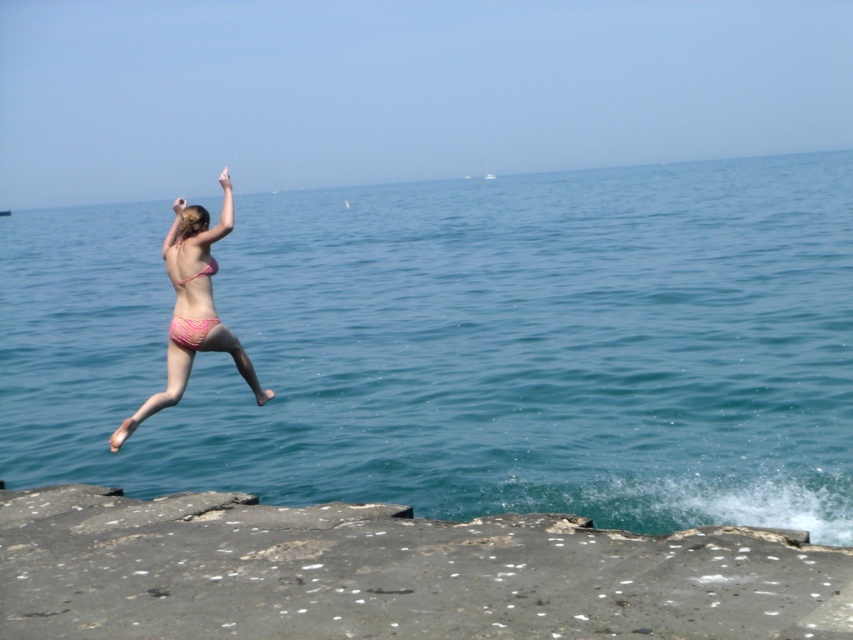
You are a photographer capturing the scene of a person jumping into the ocean. You notice two pink bikinis in the frame. Which one is closer to you, the pink bikini at center or the pink fabric bikini at left?

The pink bikini at center is closer to the viewer than the pink fabric bikini at left.

You are a photographer capturing the scene of a person jumping into the ocean. You notice two pink bikinis in the image. The first is the pink fabric bikini at left, and the second is the pink matte bikini top at center. Which bikini appears wider in the photo?

The pink fabric bikini at left appears wider than the pink matte bikini top at center because its width surpasses the latter.

You are a photographer trying to capture the perfect shot of the scene. You need to ensure that both the gray concrete cliff at lower left and the pink matte bikini top at center are clearly visible in your frame. Considering their sizes, which object should you focus on first to ensure proper exposure?

The gray concrete cliff at lower left is larger in size than the pink matte bikini top at center, so you should focus on the gray concrete cliff at lower left first to ensure proper exposure, as larger objects often require more attention to capture details accurately.